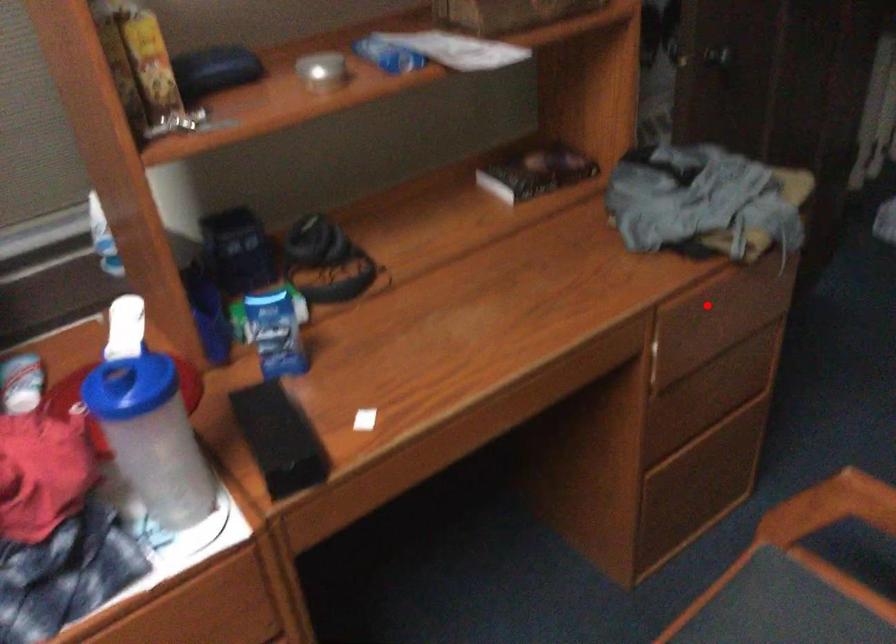
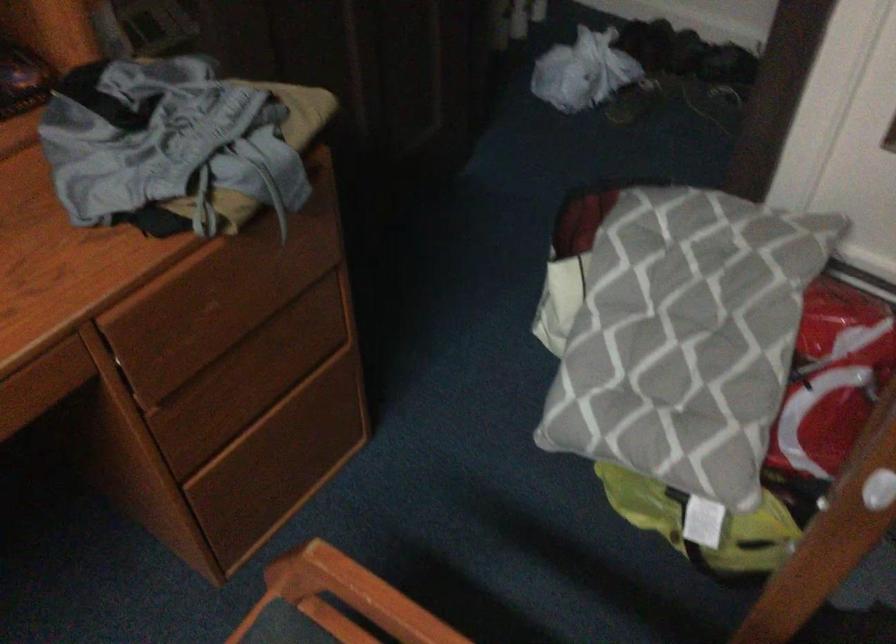
Question: I am providing you with two images of the same scene from different viewpoints. Given a red point in image1, look at the same physical point in image2. Is it:

Choices:
 (A) Closer to the viewpoint
 (B) Farther from the viewpoint

Answer: (A)